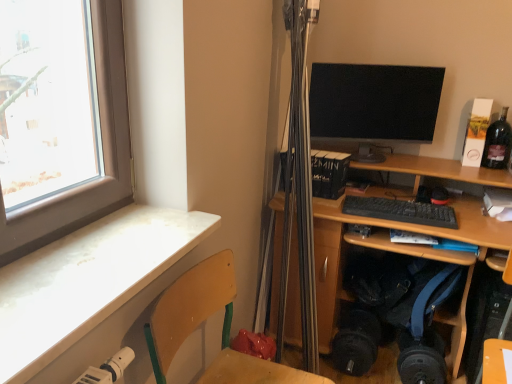
What do you see at coordinates (203, 321) in the screenshot? Image resolution: width=512 pixels, height=384 pixels. I see `wooden at left` at bounding box center [203, 321].

The width and height of the screenshot is (512, 384). Identify the location of matte black monitor at upper right. (374, 104).

From the image's perspective, relative to white marble desk at lower left, the first desk positioned from the front, is black matte keyboard at center above or below?

From the image's perspective, black matte keyboard at center appears above white marble desk at lower left, the first desk positioned from the front.

Which is in front, point (449, 228) or point (36, 358)?

The point (36, 358) is more forward.

How many degrees apart are the facing directions of black matte keyboard at center and white marble desk at lower left, acting as the 1th desk starting from the left?

The facing directions of black matte keyboard at center and white marble desk at lower left, acting as the 1th desk starting from the left, are 83.8 degrees apart.

In the scene shown: Is black matte keyboard at center aimed at white marble desk at lower left, acting as the 1th desk starting from the left?

No, black matte keyboard at center is not facing towards white marble desk at lower left, acting as the 1th desk starting from the left.

Can you tell me how much wooden at left and matte black monitor at upper right differ in facing direction?

The facing directions of wooden at left and matte black monitor at upper right are 68.6 degrees apart.

From the image's perspective, is wooden at left above or below matte black monitor at upper right?

wooden at left is below matte black monitor at upper right.

Is wooden at left wider or thinner than matte black monitor at upper right?

In the image, wooden at left appears to be wider than matte black monitor at upper right.

Is wooden at left located outside matte black monitor at upper right?

wooden at left lies outside matte black monitor at upper right's area.

Does point (340, 261) appear closer or farther from the camera than point (503, 112)?

Point (340, 261) appears to be closer to the viewer than point (503, 112).

Based on the photo, does wooden desk at center, which appears as the first desk when viewed from the right, contain dark glass bottle at upper right?

No.

From their relative heights in the image, would you say wooden desk at center, which is counted as the second desk, starting from the left, is taller or shorter than dark glass bottle at upper right?

In the image, wooden desk at center, which is counted as the second desk, starting from the left, appears to be taller than dark glass bottle at upper right.

From a real-world perspective, does wooden desk at center, which is counted as the second desk, starting from the left, sit lower than dark glass bottle at upper right?

Yes, from a real-world perspective, wooden desk at center, which is counted as the second desk, starting from the left, is beneath dark glass bottle at upper right.

Considering the relative positions of black matte keyboard at center and matte black monitor at upper right in the image provided, is black matte keyboard at center to the left or to the right of matte black monitor at upper right?

Clearly, black matte keyboard at center is on the right of matte black monitor at upper right in the image.

Which object is closer to the camera taking this photo, black matte keyboard at center or matte black monitor at upper right?

black matte keyboard at center is more forward.

Is black matte keyboard at center taller than matte black monitor at upper right?

No.

From the image's perspective, would you say black matte keyboard at center is shown under wooden at left?

Actually, black matte keyboard at center appears above wooden at left in the image.

Looking at the image, does black matte keyboard at center seem bigger or smaller compared to wooden at left?

Clearly, black matte keyboard at center is smaller in size than wooden at left.

Between black matte keyboard at center and wooden at left, which one is positioned in front?

wooden at left is closer to the camera.

What's the angular difference between black matte keyboard at center and wooden at left's facing directions?

The facing directions of black matte keyboard at center and wooden at left are 83.2 degrees apart.

Which object is positioned more to the left, dark glass bottle at upper right or white marble desk at lower left, acting as the 1th desk starting from the left?

From the viewer's perspective, white marble desk at lower left, acting as the 1th desk starting from the left, appears more on the left side.

Can you tell me how much dark glass bottle at upper right and white marble desk at lower left, acting as the 1th desk starting from the left, differ in facing direction?

There is a 90-degree angle between the facing directions of dark glass bottle at upper right and white marble desk at lower left, acting as the 1th desk starting from the left.

Does dark glass bottle at upper right have a lesser height compared to white marble desk at lower left, arranged as the 2th desk when viewed from the right?

No, dark glass bottle at upper right is not shorter than white marble desk at lower left, arranged as the 2th desk when viewed from the right.

Is dark glass bottle at upper right smaller than white marble desk at lower left, acting as the 1th desk starting from the left?

Yes, dark glass bottle at upper right is smaller than white marble desk at lower left, acting as the 1th desk starting from the left.

Could you tell me if white marble desk at lower left, arranged as the second desk when viewed from the back, is facing matte black monitor at upper right?

No, white marble desk at lower left, arranged as the second desk when viewed from the back, is not facing towards matte black monitor at upper right.

How many degrees apart are the facing directions of white marble desk at lower left, arranged as the 2th desk when viewed from the right, and matte black monitor at upper right?

white marble desk at lower left, arranged as the 2th desk when viewed from the right, and matte black monitor at upper right are facing 69.2 degrees away from each other.

Is white marble desk at lower left, acting as the 1th desk starting from the left, in front of or behind matte black monitor at upper right in the image?

Clearly, white marble desk at lower left, acting as the 1th desk starting from the left, is in front of matte black monitor at upper right.

Locate an element on the screen. computer keyboard behind the white marble desk at lower left, acting as the 1th desk starting from the left is located at coordinates (401, 211).

Identify the location of computer monitor above the wooden at left (from a real-world perspective). (374, 104).

Estimate the real-world distances between objects in this image. Which object is further from white marble desk at lower left, arranged as the second desk when viewed from the back, wooden at left or black matte keyboard at center?

black matte keyboard at center is further to white marble desk at lower left, arranged as the second desk when viewed from the back.

Looking at the image, which one is located closer to dark glass bottle at upper right, wooden desk at center, which appears as the first desk when viewed from the right, or wooden at left?

Among the two, wooden desk at center, which appears as the first desk when viewed from the right, is located nearer to dark glass bottle at upper right.

When comparing their distances from matte black monitor at upper right, does white marble desk at lower left, arranged as the 2th desk when viewed from the right, or wooden at left seem further?

white marble desk at lower left, arranged as the 2th desk when viewed from the right, lies further to matte black monitor at upper right than the other object.

Considering their positions, is black matte keyboard at center positioned closer to white marble desk at lower left, arranged as the second desk when viewed from the back, than matte black monitor at upper right?

Among the two, black matte keyboard at center is located nearer to white marble desk at lower left, arranged as the second desk when viewed from the back.

Which object lies further to the anchor point wooden desk at center, marked as the first desk in a back-to-front arrangement, wooden at left or matte black monitor at upper right?

Among the two, wooden at left is located further to wooden desk at center, marked as the first desk in a back-to-front arrangement.

When comparing their distances from dark glass bottle at upper right, does wooden desk at center, marked as the first desk in a back-to-front arrangement, or black matte keyboard at center seem closer?

black matte keyboard at center lies closer to dark glass bottle at upper right than the other object.

When comparing their distances from white marble desk at lower left, the first desk positioned from the front, does dark glass bottle at upper right or wooden desk at center, marked as the first desk in a back-to-front arrangement, seem further?

dark glass bottle at upper right lies further to white marble desk at lower left, the first desk positioned from the front, than the other object.

From the image, which object appears to be farther from wooden desk at center, marked as the first desk in a back-to-front arrangement, white marble desk at lower left, arranged as the 2th desk when viewed from the right, or wooden at left?

The object further to wooden desk at center, marked as the first desk in a back-to-front arrangement, is white marble desk at lower left, arranged as the 2th desk when viewed from the right.

Locate an element on the screen. The height and width of the screenshot is (384, 512). computer keyboard between white marble desk at lower left, arranged as the 2th desk when viewed from the right, and wooden desk at center, which is counted as the second desk, starting from the left is located at coordinates point(401,211).

Where is `desk between white marble desk at lower left, the first desk positioned from the front, and dark glass bottle at upper right`? The image size is (512, 384). desk between white marble desk at lower left, the first desk positioned from the front, and dark glass bottle at upper right is located at coordinates (400, 229).

I want to click on computer keyboard between white marble desk at lower left, arranged as the 2th desk when viewed from the right, and matte black monitor at upper right in the front-back direction, so click(x=401, y=211).

The width and height of the screenshot is (512, 384). Find the location of `folding chair between white marble desk at lower left, acting as the 1th desk starting from the left, and dark glass bottle at upper right`. folding chair between white marble desk at lower left, acting as the 1th desk starting from the left, and dark glass bottle at upper right is located at coordinates (203, 321).